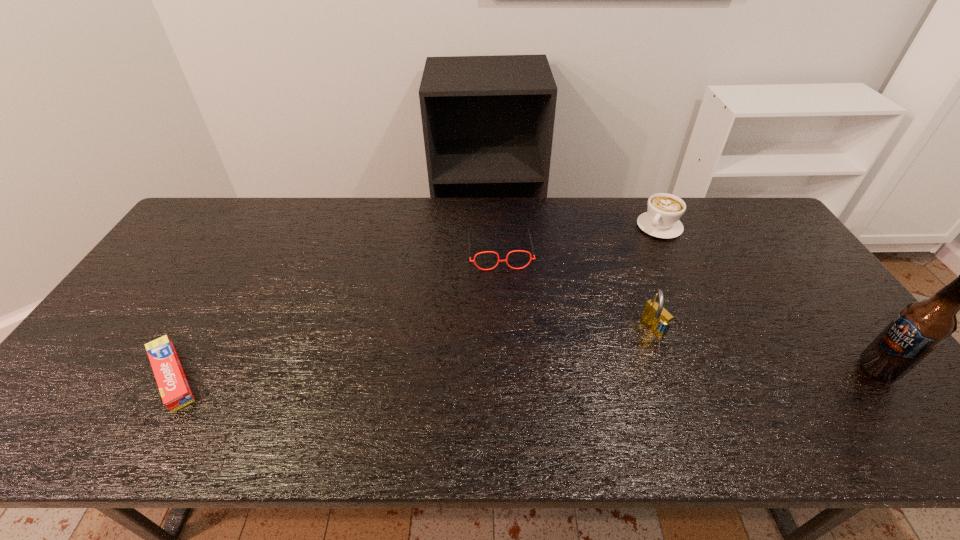
The height and width of the screenshot is (540, 960). I want to click on vacant area located 0.360m on the back of the leftmost object, so click(245, 253).

You are a GUI agent. You are given a task and a screenshot of the screen. Output one action in this format:
    pyautogui.click(x=<x>, y=<y>)
    Task: Click on the vacant space located on the label of the tallest object
    
    Given the screenshot: What is the action you would take?
    pyautogui.click(x=717, y=369)

Identify the location of vacant space located 0.050m on the label of the tallest object. The width and height of the screenshot is (960, 540). (840, 369).

At what (x,y) coordinates should I click in order to perform the action: click on free space located on the label of the tallest object. Please return your answer as a coordinate pair (x, y). Looking at the image, I should click on (755, 369).

Find the location of `free space located on the side with the combination dials of the padlock`. free space located on the side with the combination dials of the padlock is located at coordinates (611, 353).

What are the coordinates of `vacant area situated on the side with the combination dials of the padlock` in the screenshot? It's located at (577, 372).

Locate an element on the screen. vacant space situated on the side with the combination dials of the padlock is located at coordinates (619, 348).

Locate an element on the screen. blank space located on the front-facing side of the fourth object from right to left is located at coordinates click(x=505, y=288).

Locate an element on the screen. free spot located on the front-facing side of the fourth object from right to left is located at coordinates (513, 349).

Where is `vacant space located 0.320m on the front-facing side of the fourth object from right to left`? vacant space located 0.320m on the front-facing side of the fourth object from right to left is located at coordinates (514, 359).